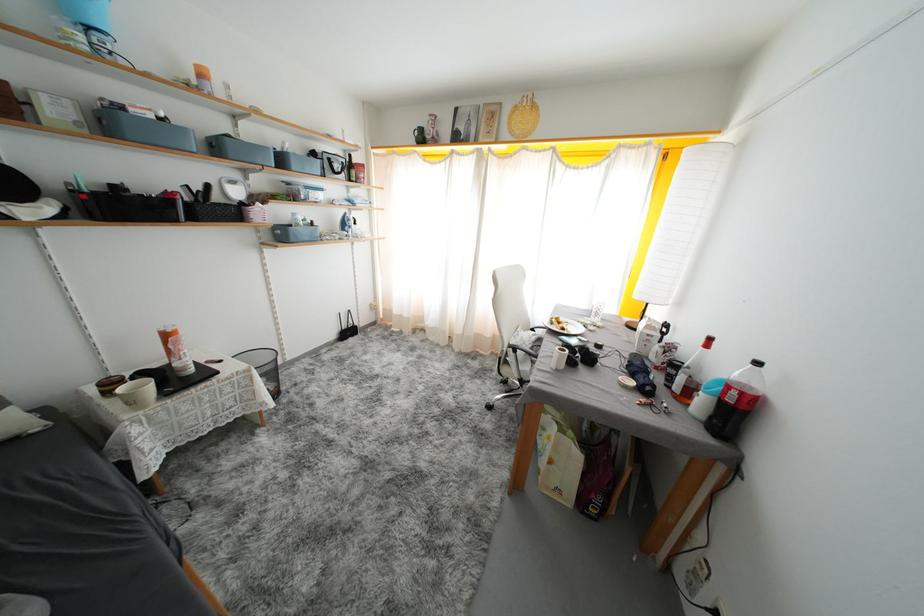
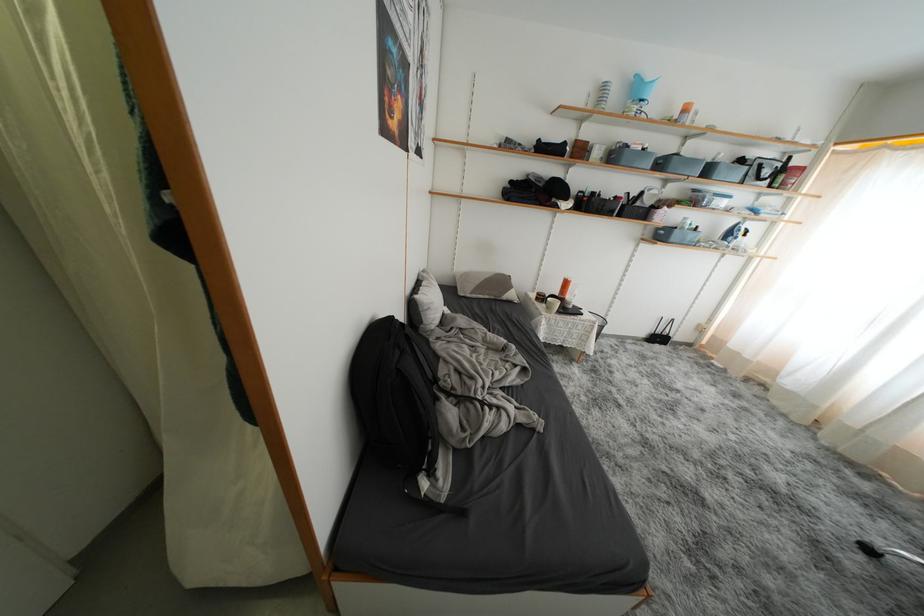
The point at (274, 241) is marked in the first image. Where is the corresponding point in the second image?

(654, 238)